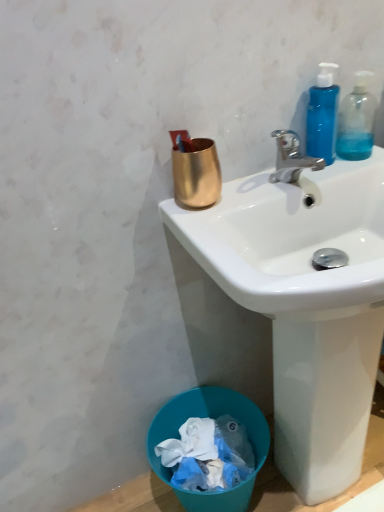
You are a GUI agent. You are given a task and a screenshot of the screen. Output one action in this format:
    pyautogui.click(x=<x>, y=<y>)
    Task: Click on the free space in front of blue translucent bottle at upper right, the 2th bottle viewed from the right
    The image size is (384, 512).
    Given the screenshot: What is the action you would take?
    pyautogui.click(x=326, y=173)